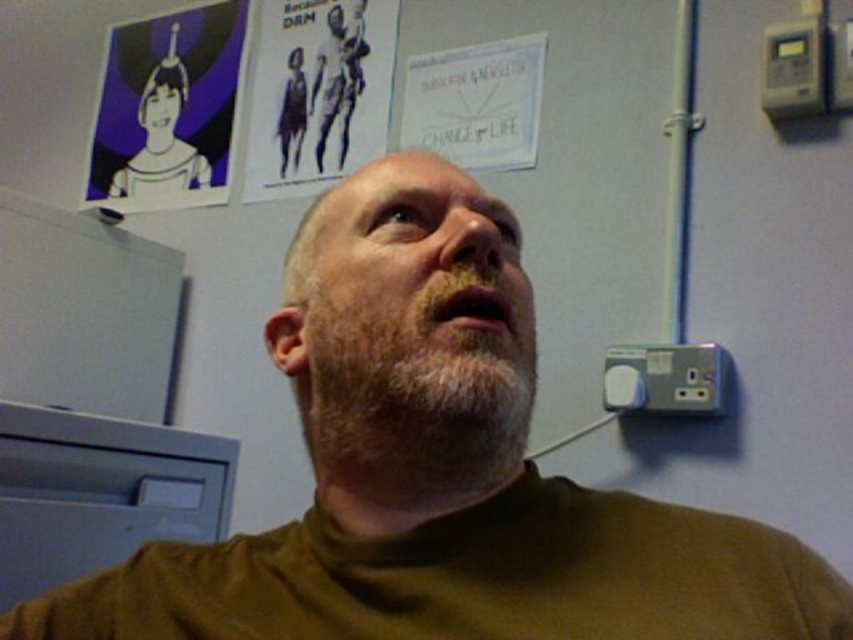
Question: Is gray matte beard at center wider than matte black face at upper left?

Choices:
 (A) yes
 (B) no

Answer: (A)

Question: Is beige facial hair at center smaller than matte paper poster at upper center?

Choices:
 (A) yes
 (B) no

Answer: (A)

Question: Which point is closer to the camera?

Choices:
 (A) (354, 38)
 (B) (149, 99)
 (C) (529, 323)

Answer: (C)

Question: Which of the following is the closest to the observer?

Choices:
 (A) (170, 97)
 (B) (479, 138)

Answer: (B)

Question: Considering the real-world distances, which object is farthest from the smooth black figure at upper center?

Choices:
 (A) purple paper at upper left
 (B) beige facial hair at center
 (C) matte black face at upper left

Answer: (B)

Question: Where is beige facial hair at center located in relation to gray matte beard at center in the image?

Choices:
 (A) left
 (B) right

Answer: (B)